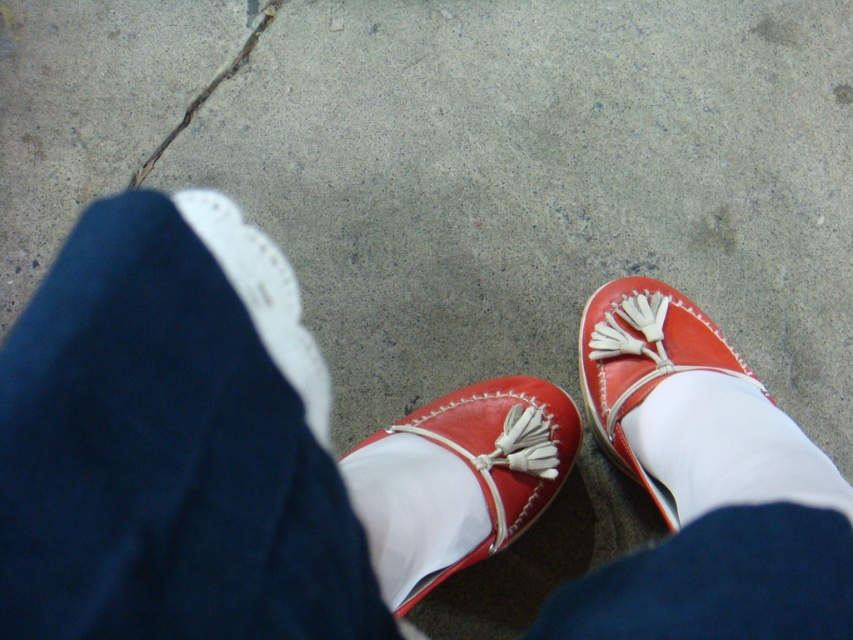
You are standing on the sidewalk and notice two items near your feet. One is the white smooth sock at lower right and the other is the white leather shoe at left. Which item is nearer to you?

The white smooth sock at lower right is closer to the viewer than the white leather shoe at left.